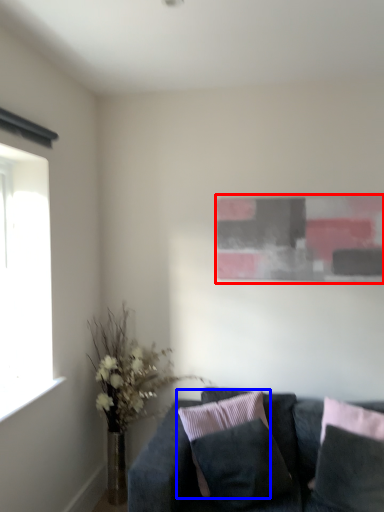
Question: Which point is further to the camera, picture frame (highlighted by a red box) or pillow (highlighted by a blue box)?

Choices:
 (A) picture frame
 (B) pillow

Answer: (A)